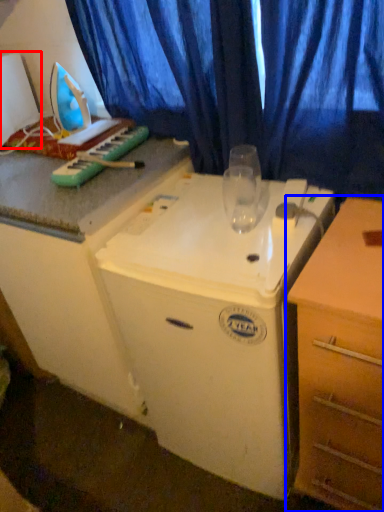
Question: Which of the following is the farthest to the observer, appliance (highlighted by a red box) or chest of drawers (highlighted by a blue box)?

Choices:
 (A) appliance
 (B) chest of drawers

Answer: (A)